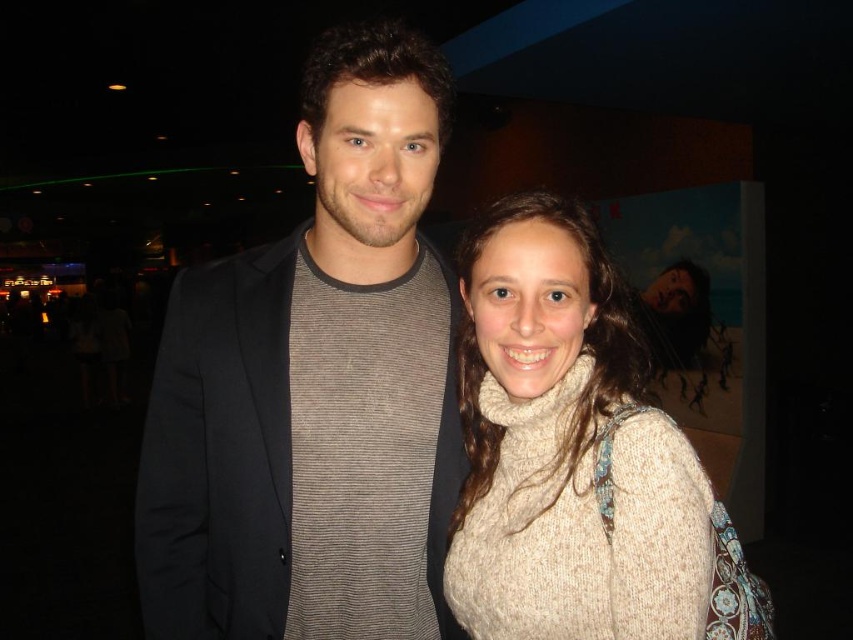
Which of these two, dark gray knit sweater at center or white knitted sweater at center, stands shorter?

Standing shorter between the two is white knitted sweater at center.

Is point (223, 426) in front of point (534, 465)?

No, it is not.

Is point (276, 547) closer to viewer compared to point (697, 584)?

No, it is behind (697, 584).

The image size is (853, 640). In order to click on dark gray knit sweater at center in this screenshot , I will do `click(314, 387)`.